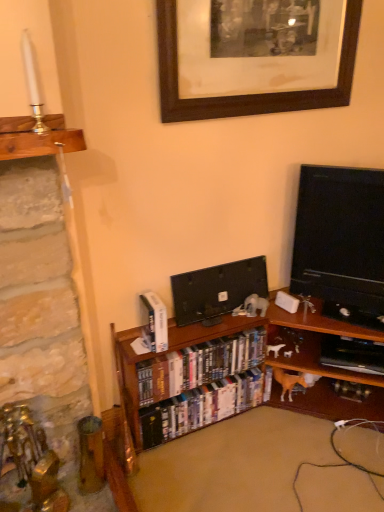
This screenshot has width=384, height=512. I want to click on empty space that is ontop of black glossy flat-screen tv at center, marked as the first television in a left-to-right arrangement (from a real-world perspective), so click(x=222, y=261).